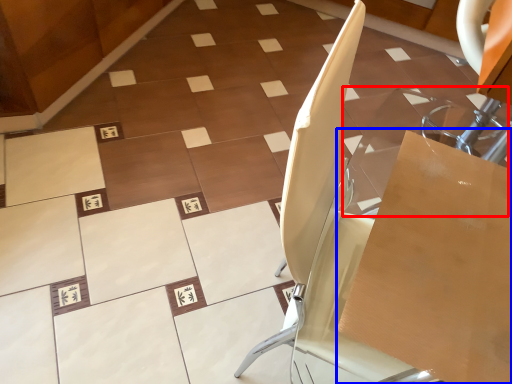
Question: Which object appears farthest to the camera in this image, glass table (highlighted by a red box) or cardboard box (highlighted by a blue box)?

Choices:
 (A) glass table
 (B) cardboard box

Answer: (A)